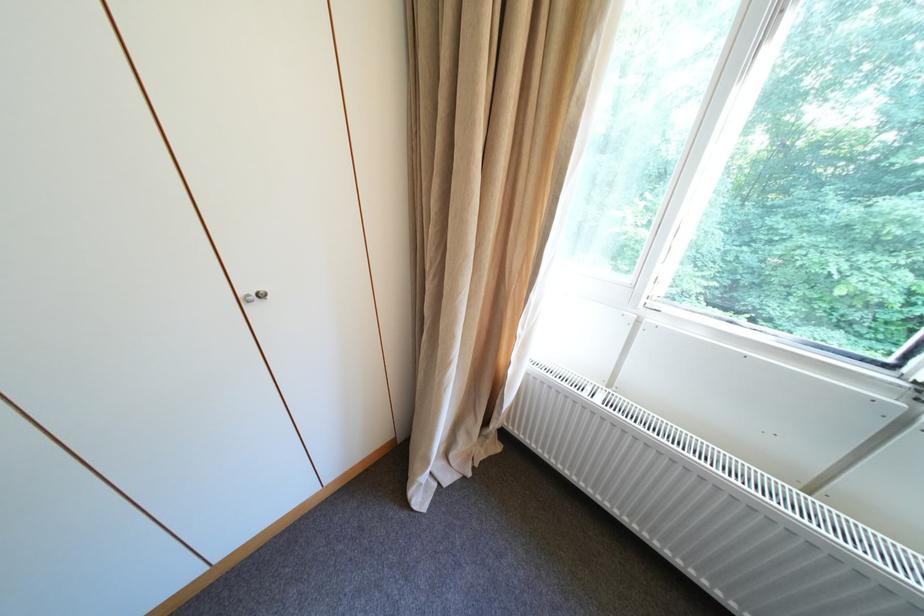
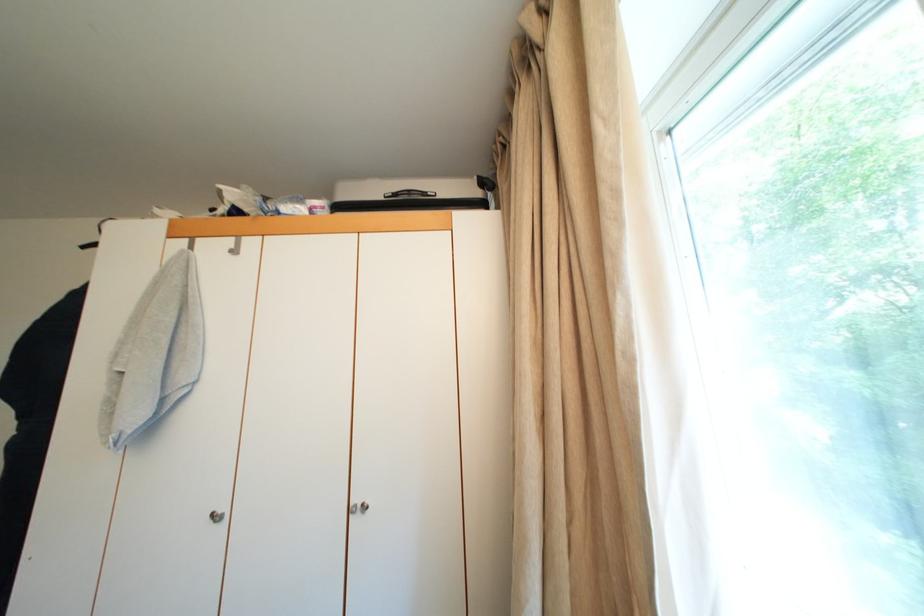
Based on the continuous images, in which direction is the camera rotating?

Answer: The camera rotated toward left-up.